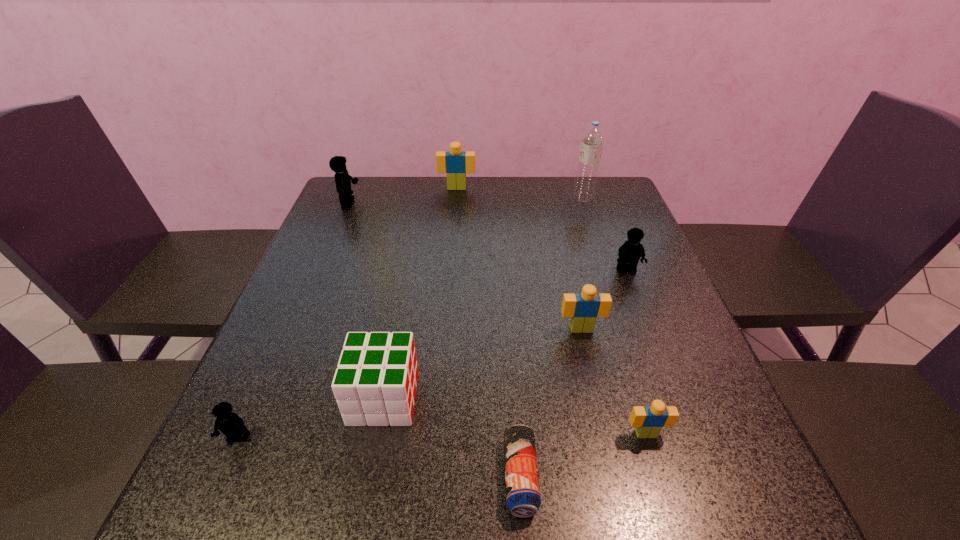
I want to click on free point at the near edge, so click(341, 502).

Locate an element on the screen. This screenshot has height=540, width=960. blank space at the left edge is located at coordinates (271, 406).

Identify the location of free space at the right edge of the desktop. (609, 227).

Where is `vacant point at the far left corner`? The height and width of the screenshot is (540, 960). vacant point at the far left corner is located at coordinates (359, 185).

The width and height of the screenshot is (960, 540). In the image, there is a desktop. Find the location of `vacant space at the far right corner`. vacant space at the far right corner is located at coordinates (571, 178).

The height and width of the screenshot is (540, 960). In order to click on free space between the tallest object and the smallest beige Lego in this screenshot , I will do `click(614, 315)`.

Locate an element on the screen. This screenshot has width=960, height=540. vacant region between the farthest beige Lego and the fifth object from right to left is located at coordinates (489, 332).

This screenshot has width=960, height=540. In order to click on free spot between the fifth nearest Lego and the sixth farthest object in this screenshot , I will do (367, 301).

Where is `free space between the biggest yellow Lego and the fifth nearest object`? The image size is (960, 540). free space between the biggest yellow Lego and the fifth nearest object is located at coordinates (465, 266).

Image resolution: width=960 pixels, height=540 pixels. I want to click on free space between the smallest beige Lego and the second farthest Lego, so click(497, 319).